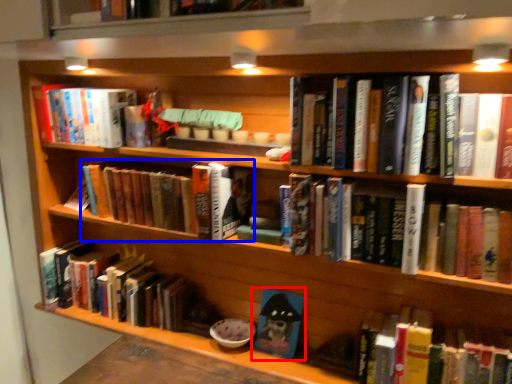
Question: Which of the following is the closest to the observer, book (highlighted by a red box) or book (highlighted by a blue box)?

Choices:
 (A) book
 (B) book

Answer: (B)